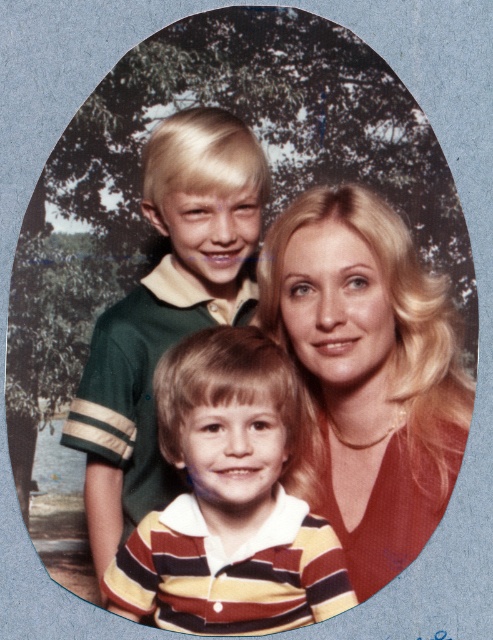
What do you see at coordinates (375, 380) in the screenshot? I see `matte green polo shirt at upper left` at bounding box center [375, 380].

Can you confirm if matte green polo shirt at upper left is taller than striped cotton shirt at center?

Yes.

Is point (397, 301) positioned in front of point (292, 467)?

Yes, it is.

The height and width of the screenshot is (640, 493). In order to click on matte green polo shirt at upper left in this screenshot , I will do `click(375, 380)`.

Does matte green polo shirt at upper left have a greater height compared to blonde hair at center?

Yes, matte green polo shirt at upper left is taller than blonde hair at center.

Describe the element at coordinates (375, 380) in the screenshot. I see `matte green polo shirt at upper left` at that location.

This screenshot has height=640, width=493. I want to click on matte green polo shirt at upper left, so click(375, 380).

Which is more to the left, matte green polo shirt at upper left or green jersey at center?

green jersey at center is more to the left.

Does matte green polo shirt at upper left have a smaller size compared to green jersey at center?

No.

Does point (282, 336) come closer to viewer compared to point (211, 140)?

That is True.

This screenshot has height=640, width=493. I want to click on matte green polo shirt at upper left, so click(375, 380).